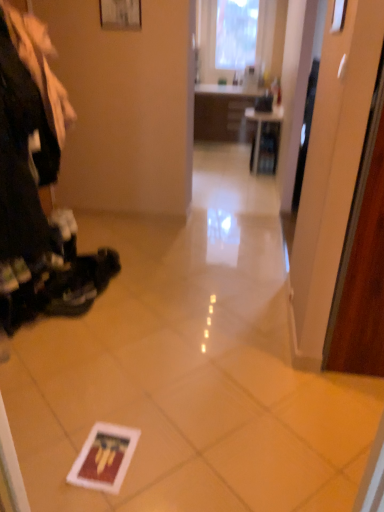
Question: Does matte black shelf at center have a lesser width compared to matte white picture frame at upper center?

Choices:
 (A) no
 (B) yes

Answer: (A)

Question: From a real-world perspective, is matte black shelf at center positioned over matte white picture frame at upper center based on gravity?

Choices:
 (A) yes
 (B) no

Answer: (B)

Question: Is matte black shelf at center positioned with its back to matte white picture frame at upper center?

Choices:
 (A) no
 (B) yes

Answer: (A)

Question: Are matte black shelf at center and matte white picture frame at upper center beside each other?

Choices:
 (A) no
 (B) yes

Answer: (A)

Question: Does matte black shelf at center have a greater width compared to matte white picture frame at upper center?

Choices:
 (A) yes
 (B) no

Answer: (A)

Question: Is matte black shelf at center not inside matte white picture frame at upper center?

Choices:
 (A) no
 (B) yes

Answer: (B)

Question: Is the position of matte white picture frame at upper center less distant than that of matte black shelf at center?

Choices:
 (A) no
 (B) yes

Answer: (B)

Question: Is matte white picture frame at upper center thinner than matte black shelf at center?

Choices:
 (A) yes
 (B) no

Answer: (A)

Question: Can you confirm if matte white picture frame at upper center is taller than matte black shelf at center?

Choices:
 (A) no
 (B) yes

Answer: (A)

Question: Can you confirm if matte white picture frame at upper center is positioned to the right of matte black shelf at center?

Choices:
 (A) yes
 (B) no

Answer: (B)

Question: Would you say matte white picture frame at upper center is a long distance from matte black shelf at center?

Choices:
 (A) no
 (B) yes

Answer: (B)

Question: Would you say matte white picture frame at upper center contains matte black shelf at center?

Choices:
 (A) no
 (B) yes

Answer: (A)

Question: From the image's perspective, is matte black shelf at center located above or below matte white picture frame at upper center?

Choices:
 (A) above
 (B) below

Answer: (B)